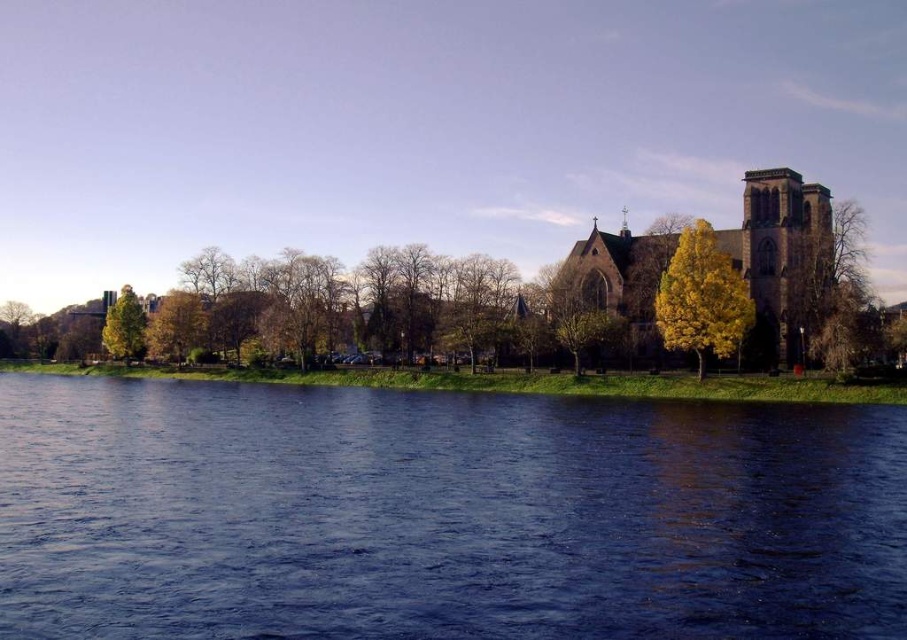
You are standing at the riverside and want to take a photo of both the green leafy tree at right and the green leafy tree at left. Which tree should you position closer to you to ensure both are in the frame?

You should position yourself closer to the green leafy tree at right because it is in front of the green leafy tree at left, so it will naturally be closer to your viewpoint.